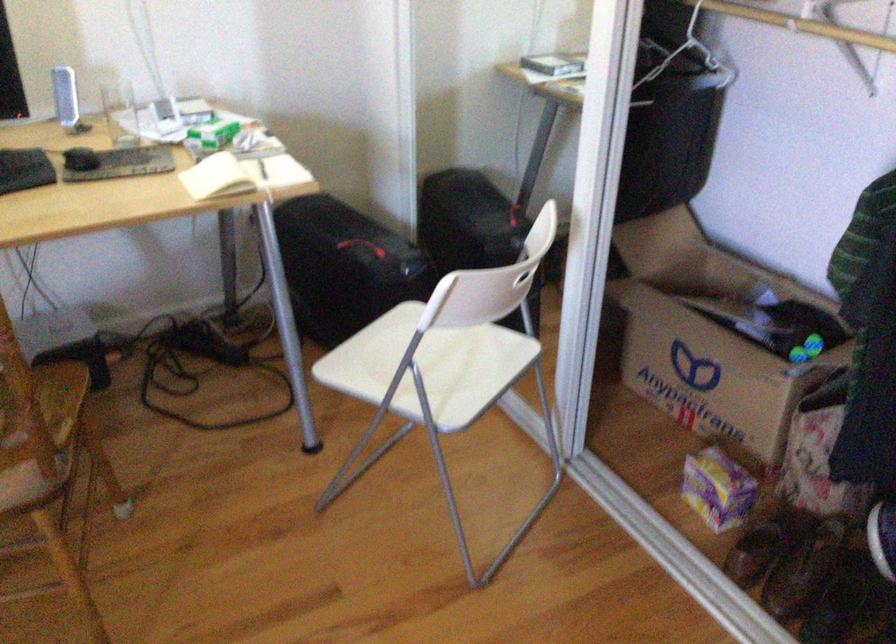
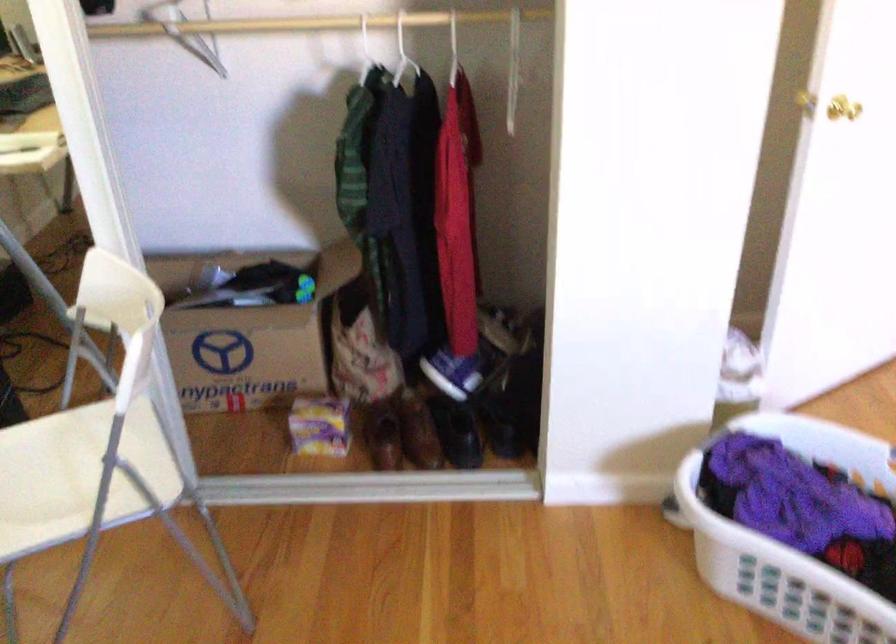
Question: How did the camera likely rotate?

Choices:
 (A) Left
 (B) Right
 (C) Up
 (D) Down

Answer: (B)